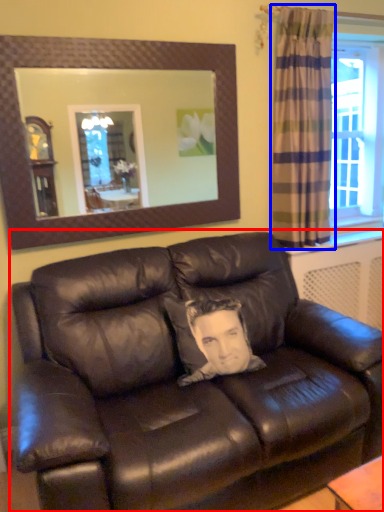
Question: Which point is closer to the camera, studio couch (highlighted by a red box) or curtain (highlighted by a blue box)?

Choices:
 (A) studio couch
 (B) curtain

Answer: (A)